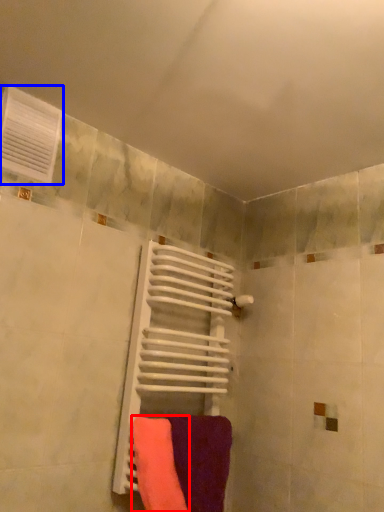
Question: Which point is further to the camera, towel (highlighted by a red box) or air conditioning (highlighted by a blue box)?

Choices:
 (A) towel
 (B) air conditioning

Answer: (B)